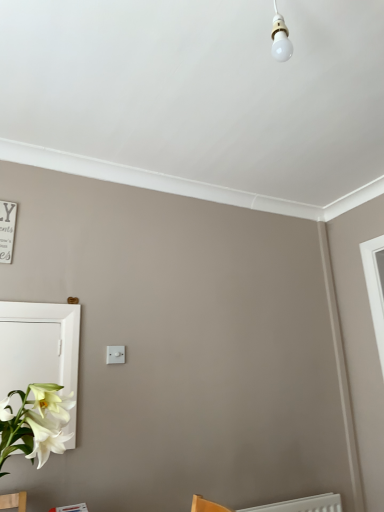
This screenshot has height=512, width=384. What do you see at coordinates (115, 354) in the screenshot?
I see `white plastic light switch at center` at bounding box center [115, 354].

You are a GUI agent. You are given a task and a screenshot of the screen. Output one action in this format:
    pyautogui.click(x=<x>, y=<y>)
    Task: Click on the white plastic light switch at center
    The height and width of the screenshot is (512, 384).
    Given the screenshot: What is the action you would take?
    pyautogui.click(x=115, y=354)

Describe the element at coordinates (40, 350) in the screenshot. I see `white glossy medicine cabinet at lower left` at that location.

This screenshot has height=512, width=384. Find the location of `white glossy medicine cabinet at lower left`. white glossy medicine cabinet at lower left is located at coordinates pyautogui.click(x=40, y=350).

Measure the distance between white glossy medicine cabinet at lower left and camera.

A distance of 1.79 meters exists between white glossy medicine cabinet at lower left and camera.

The image size is (384, 512). I want to click on white plastic light switch at center, so click(115, 354).

Which is more to the right, white plastic light switch at center or white glossy medicine cabinet at lower left?

Positioned to the right is white plastic light switch at center.

Is the depth of white plastic light switch at center less than that of white glossy medicine cabinet at lower left?

No, it is behind white glossy medicine cabinet at lower left.

Which is in front, point (116, 348) or point (42, 439)?

The point (42, 439) is closer to the camera.

From the image's perspective, which is below, white plastic light switch at center or white glossy medicine cabinet at lower left?

white glossy medicine cabinet at lower left appears lower in the image.

From a real-world perspective, is white plastic light switch at center positioned above or below white glossy medicine cabinet at lower left?

white plastic light switch at center is above white glossy medicine cabinet at lower left.

Which of these two, white plastic light switch at center or white glossy medicine cabinet at lower left, is thinner?

Thinner between the two is white plastic light switch at center.

Looking at this image, is white plastic light switch at center taller than white glossy medicine cabinet at lower left?

No.

Considering the sizes of objects white plastic light switch at center and white glossy medicine cabinet at lower left in the image provided, who is smaller, white plastic light switch at center or white glossy medicine cabinet at lower left?

Smaller between the two is white plastic light switch at center.

Is white glossy medicine cabinet at lower left a part of white plastic light switch at center?

No, white glossy medicine cabinet at lower left is located outside of white plastic light switch at center.

Are white plastic light switch at center and white glossy medicine cabinet at lower left making contact?

No, white plastic light switch at center is not touching white glossy medicine cabinet at lower left.

Is white plastic light switch at center facing towards white glossy medicine cabinet at lower left?

No, white plastic light switch at center is not facing towards white glossy medicine cabinet at lower left.

Can you tell me how much white plastic light switch at center and white glossy medicine cabinet at lower left differ in facing direction?

They differ by 0.523 degrees in their facing directions.

How far apart are white plastic light switch at center and white glossy medicine cabinet at lower left?

They are 11.71 inches apart.

Locate an element on the screen. light switch above the white glossy medicine cabinet at lower left (from the image's perspective) is located at coordinates (115, 354).

Is white glossy medicine cabinet at lower left at the right side of white plastic light switch at center?

In fact, white glossy medicine cabinet at lower left is to the left of white plastic light switch at center.

Consider the image. Between white glossy medicine cabinet at lower left and white plastic light switch at center, which one is positioned in front?

white glossy medicine cabinet at lower left is closer to the camera.

Which point is more forward, (16, 360) or (122, 357)?

Point (16, 360)

From the image's perspective, who appears lower, white glossy medicine cabinet at lower left or white plastic light switch at center?

white glossy medicine cabinet at lower left is shown below in the image.

From a real-world perspective, which object stands above the other?

white plastic light switch at center.

Is white glossy medicine cabinet at lower left wider than white plastic light switch at center?

Correct, the width of white glossy medicine cabinet at lower left exceeds that of white plastic light switch at center.

Between white glossy medicine cabinet at lower left and white plastic light switch at center, which one has less height?

Standing shorter between the two is white plastic light switch at center.

Considering the relative sizes of white glossy medicine cabinet at lower left and white plastic light switch at center in the image provided, is white glossy medicine cabinet at lower left bigger than white plastic light switch at center?

Correct, white glossy medicine cabinet at lower left is larger in size than white plastic light switch at center.

Choose the correct answer: Is white glossy medicine cabinet at lower left inside white plastic light switch at center or outside it?

white glossy medicine cabinet at lower left is outside white plastic light switch at center.

Is white glossy medicine cabinet at lower left not near white plastic light switch at center?

No, white glossy medicine cabinet at lower left is not far away from white plastic light switch at center.

Does white glossy medicine cabinet at lower left turn towards white plastic light switch at center?

No, white glossy medicine cabinet at lower left is not facing towards white plastic light switch at center.

Can you tell me how much white glossy medicine cabinet at lower left and white plastic light switch at center differ in facing direction?

The angular difference between white glossy medicine cabinet at lower left and white plastic light switch at center is 0.523 degrees.

I want to click on medicine cabinet on the left of the white plastic light switch at center, so click(x=40, y=350).

This screenshot has height=512, width=384. I want to click on light switch to the right of white glossy medicine cabinet at lower left, so click(115, 354).

Locate an element on the screen. This screenshot has height=512, width=384. medicine cabinet lying below the white plastic light switch at center (from the image's perspective) is located at coordinates (40, 350).